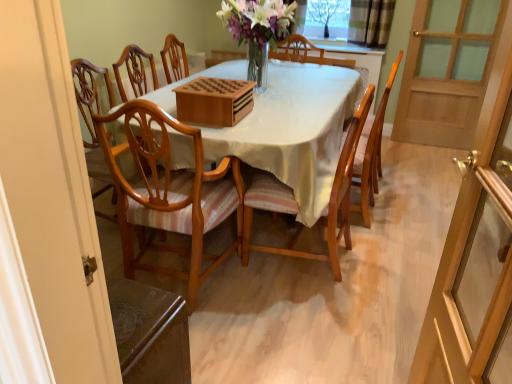
Identify the location of vacant space behind translucent glass vase at center. (281, 75).